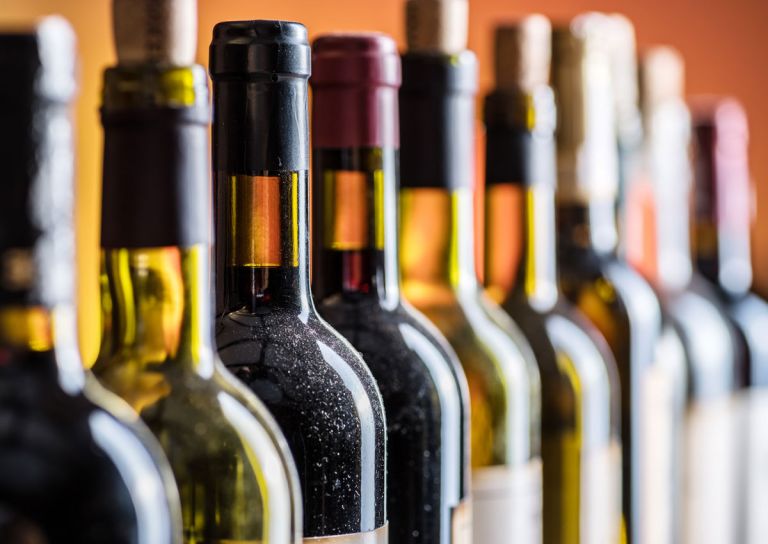
Where is `wine bottles`? wine bottles is located at coordinates (719, 156), (672, 123), (591, 111), (531, 100), (449, 86), (368, 83), (286, 86), (163, 77), (32, 149).